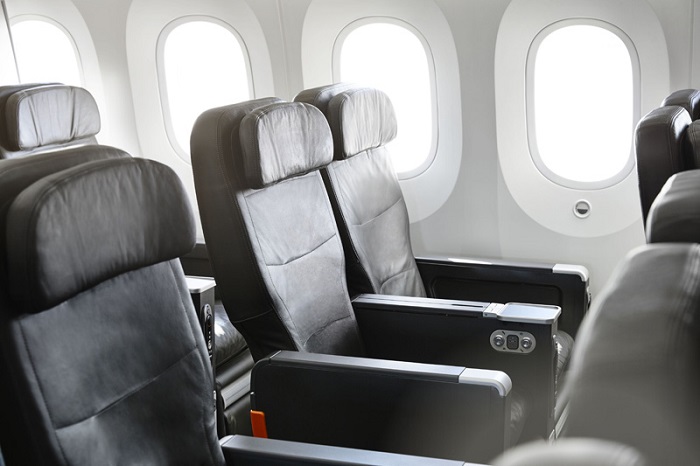
What are the coordinates of `seats` in the screenshot? It's located at (85, 249), (47, 114), (370, 147), (274, 143), (671, 142), (673, 93), (629, 272), (673, 202), (554, 453).